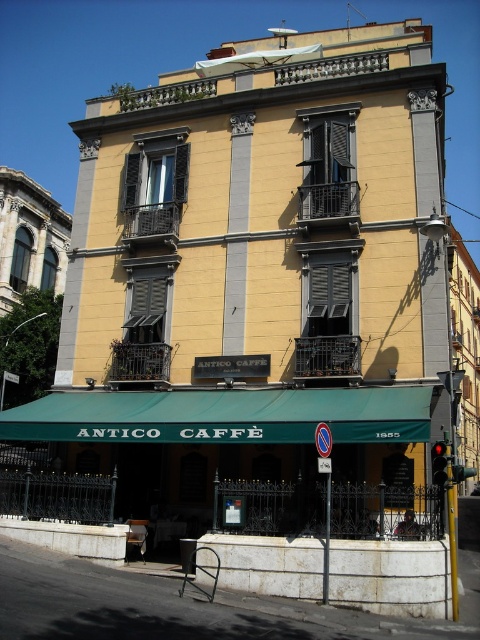
Based on the photo, you are standing in front of the three story building. There is a point at coordinate (313,372). Can you reach this point without moving closer to the building?

The point at coordinate (313,372) is 116.64 feet away from the viewer. Since you are already standing in front of the building, moving closer to the building would require approaching it, but the point is quite far away, so reaching it without moving closer may not be possible unless you have a tool or device that can extend your reach that distance.

You are a window installer who needs to replace the black matte shutters at center and the black matte shutter at center. According to the building specifications, the larger shutter must be installed on the second floor. Which one should be placed there?

The black matte shutter at center should be placed on the second floor because it is larger than the black matte shutters at center.

You are standing in front of the three story building and want to locate the black matte shutters at center. According to the coordinates provided, where would you look to find them?

The black matte shutters at center are located at the 2D coordinates point (327, 320).